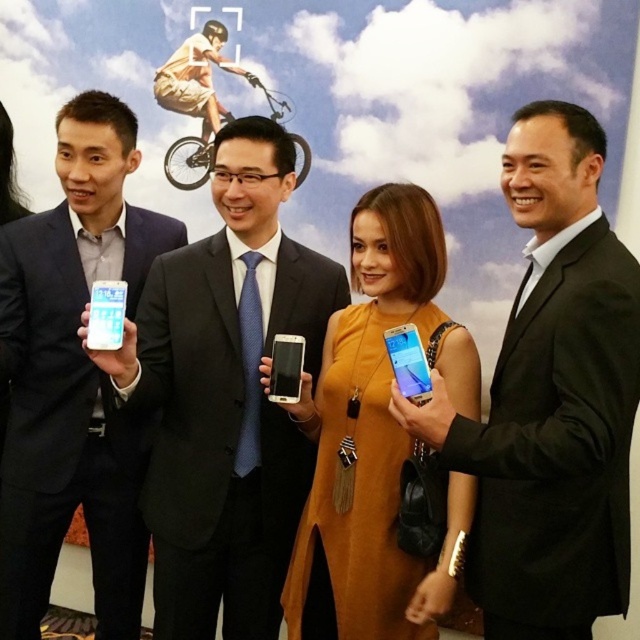
Question: Is matte black suit at left wider than satin silver smartphone at center?

Choices:
 (A) no
 (B) yes

Answer: (B)

Question: Does matte black suit at center have a smaller size compared to orange suede dress at center?

Choices:
 (A) no
 (B) yes

Answer: (A)

Question: Which object is closer to the camera taking this photo?

Choices:
 (A) satin silver smartphone at center
 (B) black suit at right
 (C) matte black suit at center
 (D) matte black suit at left

Answer: (B)

Question: Among these points, which one is farthest from the camera?

Choices:
 (A) (102, 538)
 (B) (324, 605)
 (C) (285, 369)

Answer: (A)

Question: Does orange suede dress at center appear over satin silver smartphone at center?

Choices:
 (A) yes
 (B) no

Answer: (B)

Question: Which object appears closest to the camera in this image?

Choices:
 (A) satin silver smartphone at center
 (B) black suit at right
 (C) matte black suit at left

Answer: (B)